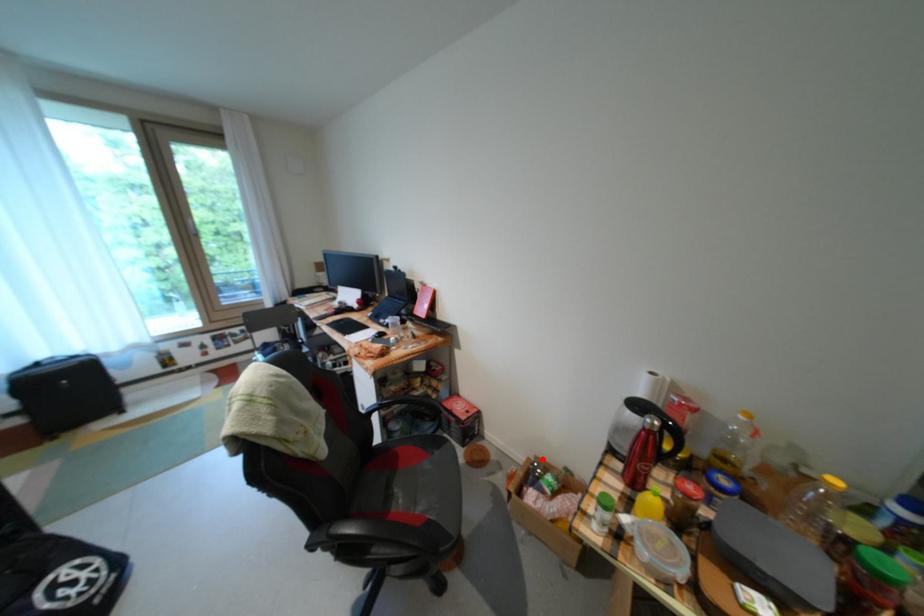
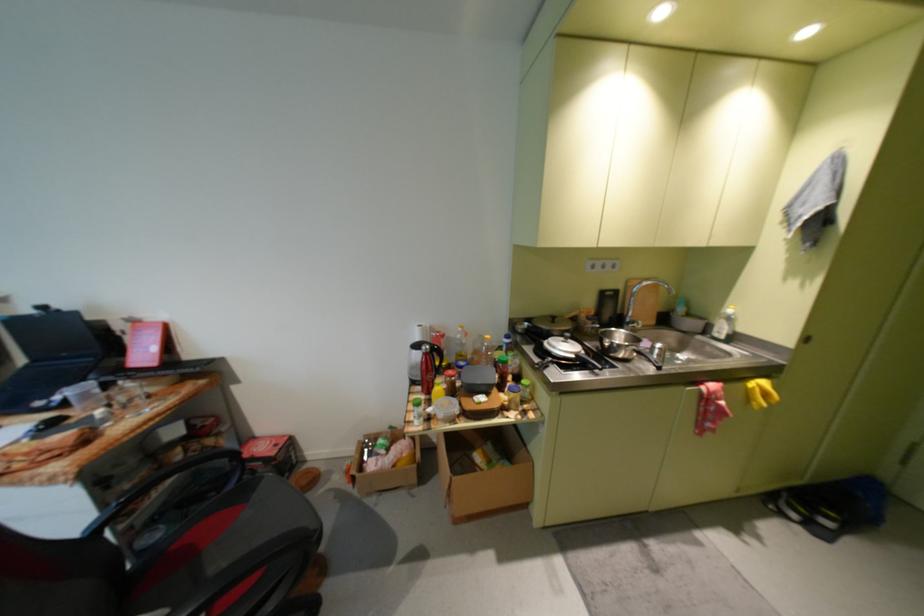
The point at the highlighted location is marked in the first image. Where is the corresponding point in the second image?

(372, 440)